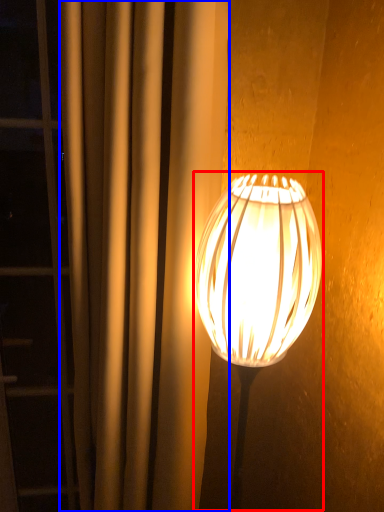
Question: Which point is further to the camera, lamp (highlighted by a red box) or curtain (highlighted by a blue box)?

Choices:
 (A) lamp
 (B) curtain

Answer: (B)